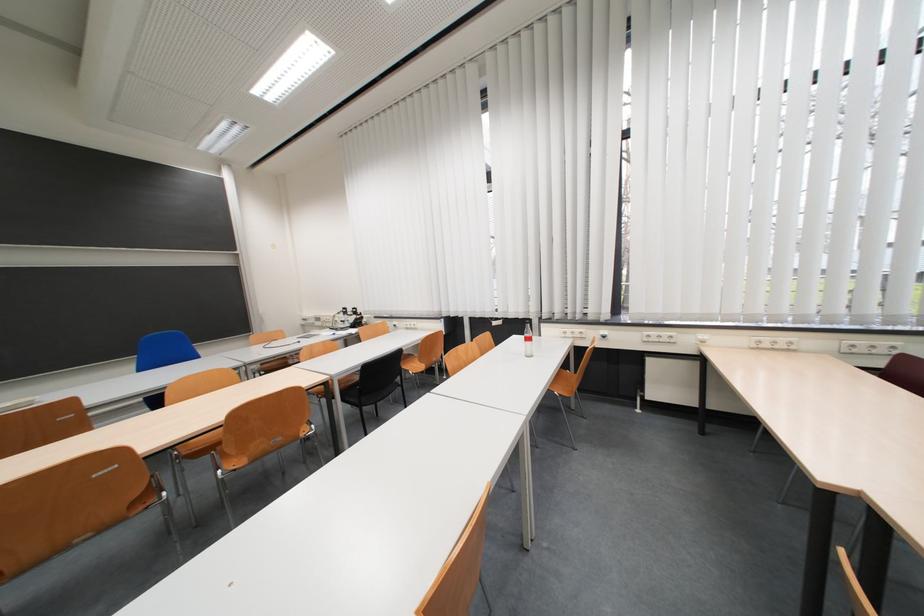
At what (x,y) coordinates should I click in order to perform the action: click on black chair sitting surface. Please return your answer as a coordinate pair (x, y). The height and width of the screenshot is (616, 924). Looking at the image, I should click on (374, 386).